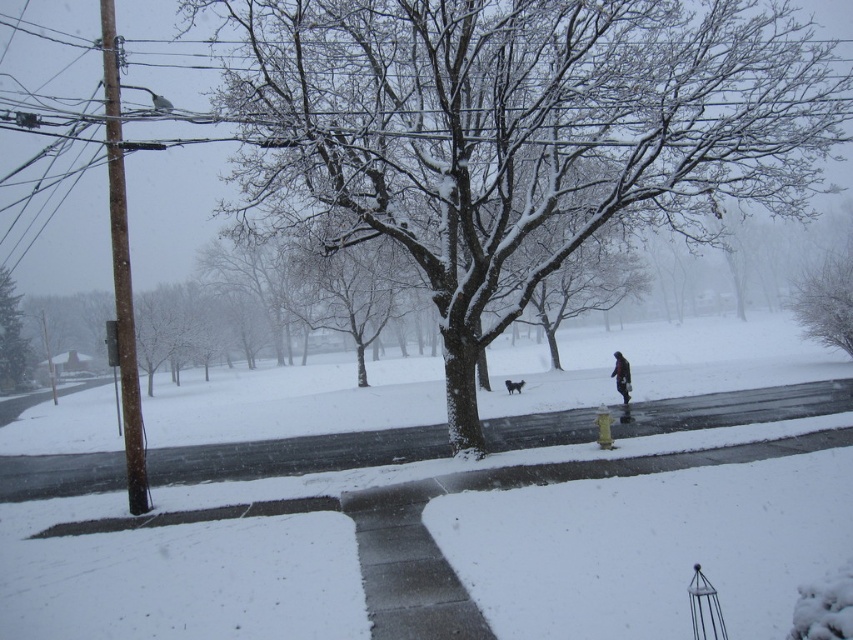
Question: Estimate the real-world distances between objects in this image. Which object is farther from the snow-covered tree at left?

Choices:
 (A) white powdery snow at center
 (B) frosted white tree at upper right

Answer: (B)

Question: Which object is closer to the camera taking this photo?

Choices:
 (A) snow-covered tree at center
 (B) black fur dog at center
 (C) snow-covered tree at left

Answer: (A)

Question: Which object appears farthest from the camera in this image?

Choices:
 (A) white powdery snow at center
 (B) dark gray coat at center
 (C) black fur dog at center

Answer: (C)

Question: Does snow-covered tree at left appear over black fur dog at center?

Choices:
 (A) yes
 (B) no

Answer: (A)

Question: Considering the relative positions of snow-covered tree at center and black fur dog at center in the image provided, where is snow-covered tree at center located with respect to black fur dog at center?

Choices:
 (A) above
 (B) below

Answer: (A)

Question: Can you confirm if dark gray coat at center is bigger than black fur dog at center?

Choices:
 (A) yes
 (B) no

Answer: (A)